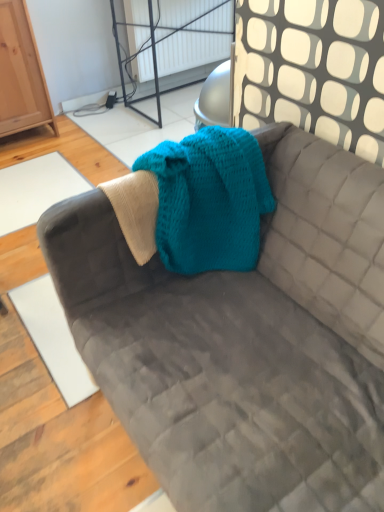
Describe the element at coordinates (245, 340) in the screenshot. I see `velvet gray couch at center` at that location.

This screenshot has width=384, height=512. What are the coordinates of `velvet gray couch at center` in the screenshot? It's located at (245, 340).

Based on the photo, in order to face velvet gray couch at center, should I rotate leftwards or rightwards?

To align with it, rotate right about 10.265°.

Locate an element on the screen. The image size is (384, 512). velvet gray couch at center is located at coordinates (245, 340).